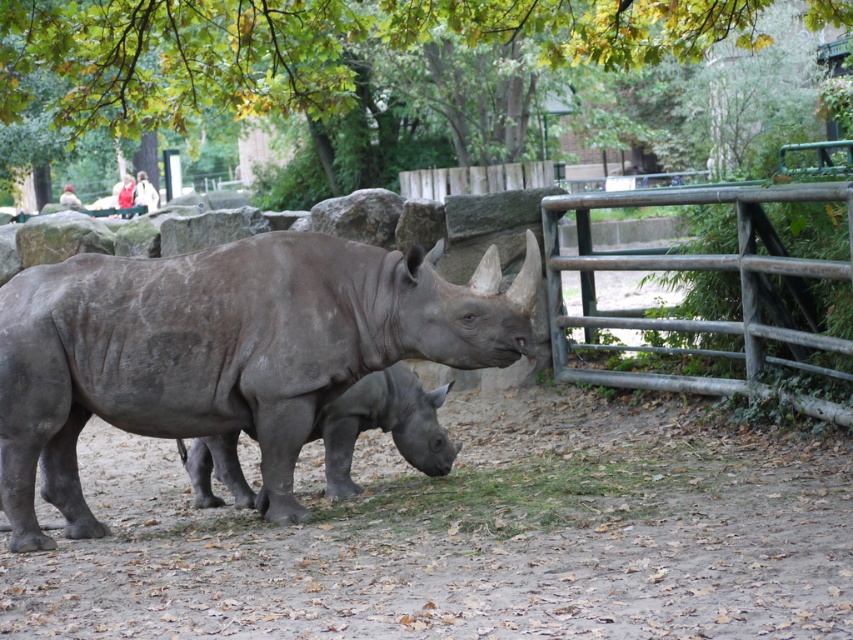
Is gray matte rhinoceros at center bigger than green bamboo fence at right?

No, gray matte rhinoceros at center is not bigger than green bamboo fence at right.

Which is behind, point (508, 356) or point (795, 278)?

The point (795, 278) is behind.

At what (x,y) coordinates should I click in order to perform the action: click on gray matte rhinoceros at center. Please return your answer as a coordinate pair (x, y). This screenshot has width=853, height=640. Looking at the image, I should click on (225, 349).

Is green bamboo fence at right positioned at the back of gray matte rhino at center?

No.

Is point (608, 314) behind point (204, 490)?

Yes.

Who is more distant from viewer, [769,339] or [231,433]?

Positioned behind is point [769,339].

Identify the location of green bamboo fence at right. (703, 269).

Can you confirm if gray matte rhinoceros at center is taller than white cotton jacket at upper left?

Yes, gray matte rhinoceros at center is taller than white cotton jacket at upper left.

Measure the distance between gray matte rhinoceros at center and camera.

gray matte rhinoceros at center and camera are 6.96 meters apart from each other.

At what (x,y) coordinates should I click in order to perform the action: click on gray matte rhinoceros at center. Please return your answer as a coordinate pair (x, y). Looking at the image, I should click on (225, 349).